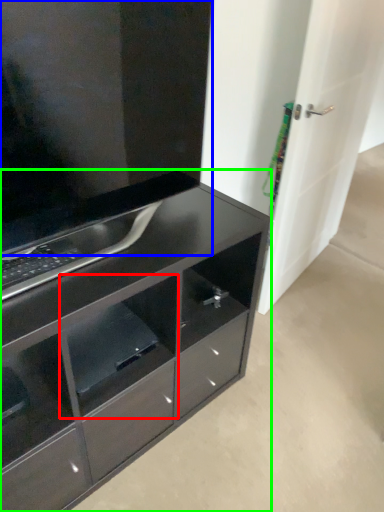
Question: Based on their relative distances, which object is nearer to shelf (highlighted by a red box)? Choose from cabinetry (highlighted by a blue box) and chest of drawers (highlighted by a green box).

Choices:
 (A) cabinetry
 (B) chest of drawers

Answer: (B)